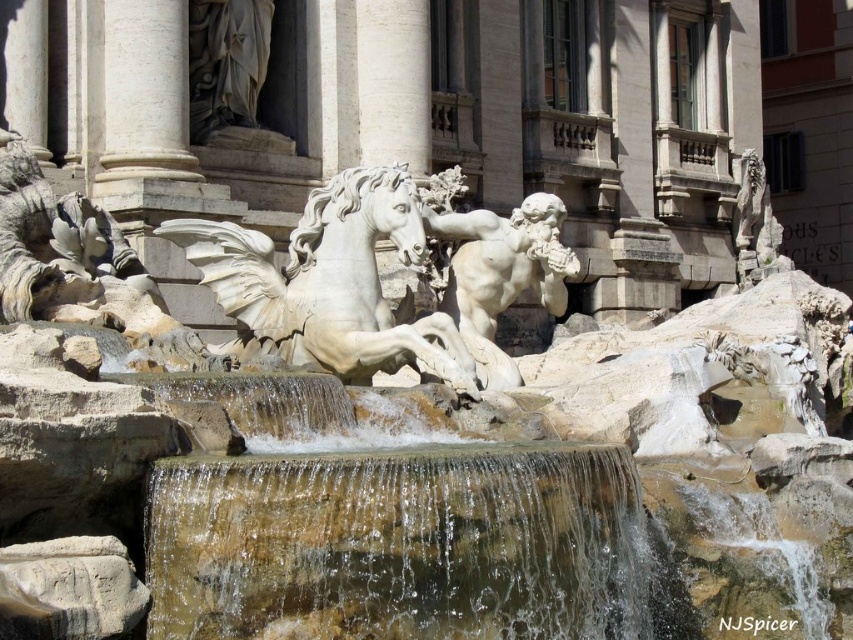
You are standing at the Trevi Fountain and see the white marble horse at center and the white marble statue at center. Which one has a greater width?

The white marble horse at center might be wider than the white marble statue at center according to the description.

You are a tourist visiting the Trevi Fountain and want to take a photo that includes both the white marble statue at center and the white marble column at upper center. Based on their sizes, which one should you focus on to ensure both are visible in the frame?

The white marble statue at center is bigger than the white marble column at upper center, so you should focus on the white marble statue at center to ensure both are visible in the frame since it takes up more space and the column will still fit in the background.

You are visiting the Trevi Fountain and want to take a photo that includes both the translucent stone waterfall at center and the white marble column at upper center. Which object should you position closer to the center of your camera frame to ensure both are visible in the photo?

Since the translucent stone waterfall at center is larger in size than the white marble column at upper center, you should position the translucent stone waterfall at center closer to the center of your camera frame to ensure both are visible in the photo.